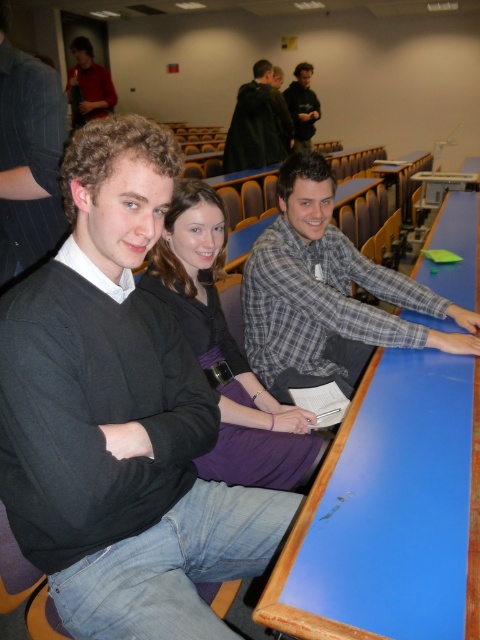
You are standing in the classroom and need to find the purple fabric dress at center. According to the scene description, where should you look to locate it?

The purple fabric dress at center is located at point (x=226, y=352) in the image coordinates.

You are a student entering the classroom and need to place your backpack on the blue glossy table at center and the black pinstripe suit at center. Which one is lower so you can place it there?

The blue glossy table at center is located below the black pinstripe suit at center, so you should place your backpack on the blue glossy table at center since it is lower.

Consider the image. You are standing in the classroom and want to reach both points on the desk. Which point, point (468, 592) or point (97, 90), will you reach first if you walk straight towards them?

Point (468, 592) is closer to the viewer than point (97, 90), so you will reach point (468, 592) first.